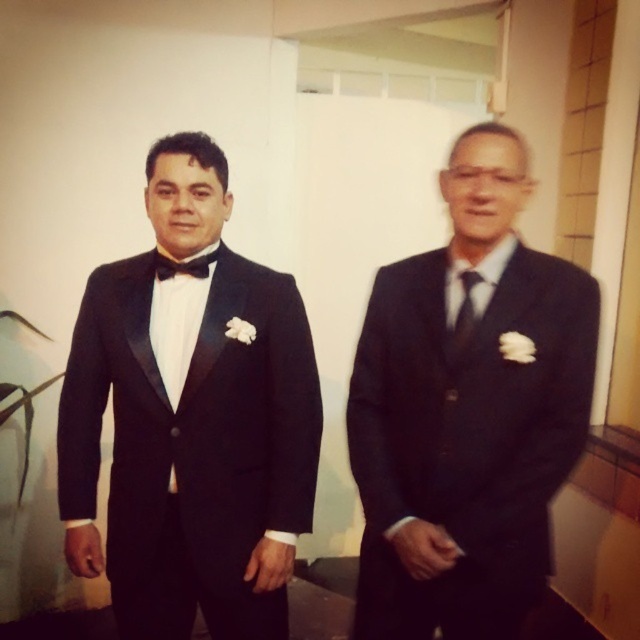
Question: Can you confirm if matte black suit at center is bigger than satin black tie at center?

Choices:
 (A) no
 (B) yes

Answer: (B)

Question: Which point is farther to the camera?

Choices:
 (A) black satin bow tie at center
 (B) matte black suit at center
 (C) matte black tuxedo at left
 (D) satin black tie at center

Answer: (A)

Question: Does matte black tuxedo at left come behind satin black tie at center?

Choices:
 (A) yes
 (B) no

Answer: (A)

Question: Does matte black tuxedo at left have a larger size compared to black satin bow tie at center?

Choices:
 (A) yes
 (B) no

Answer: (A)

Question: Estimate the real-world distances between objects in this image. Which object is closer to the satin black tie at center?

Choices:
 (A) matte black suit at center
 (B) black satin bow tie at center
 (C) matte black tuxedo at left

Answer: (A)

Question: Which object is closer to the camera taking this photo?

Choices:
 (A) matte black suit at center
 (B) matte black tuxedo at left
 (C) black satin bow tie at center

Answer: (A)